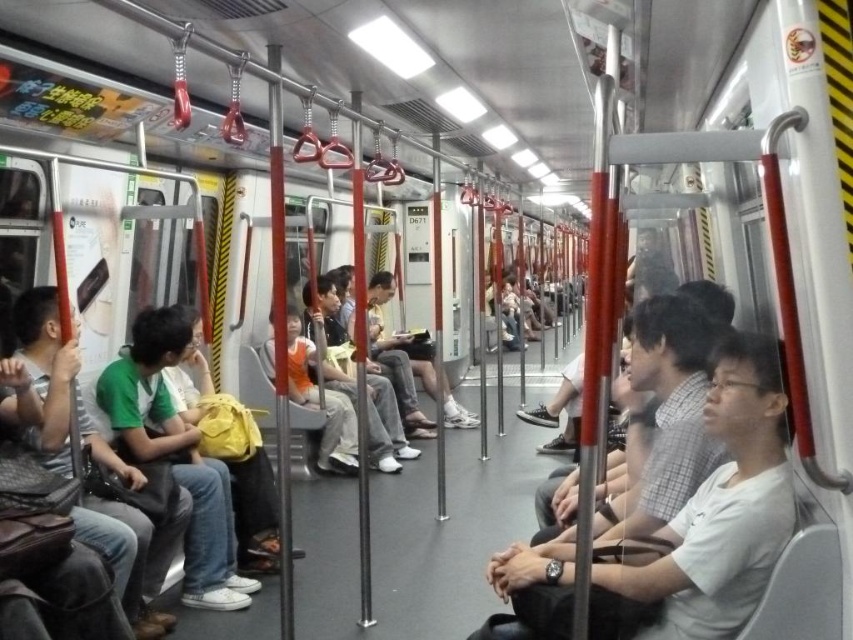
Is white matte shirt at right below yellow fabric backpack at center?

Yes.

Is point (738, 625) farther from viewer compared to point (184, 408)?

No, (738, 625) is closer to viewer.

Between point (773, 483) and point (264, 506), which one is positioned behind?

Point (264, 506)

This screenshot has height=640, width=853. Identify the location of white matte shirt at right. (709, 516).

Can you confirm if green fabric backpack at left is positioned to the right of yellow fabric backpack at center?

Yes, green fabric backpack at left is to the right of yellow fabric backpack at center.

This screenshot has width=853, height=640. I want to click on green fabric backpack at left, so coord(177,454).

Where is `green fabric backpack at left`? The height and width of the screenshot is (640, 853). green fabric backpack at left is located at coordinates (177, 454).

Which is above, white matte shirt at right or green fabric backpack at left?

white matte shirt at right is above.

Is white matte shirt at right bigger than green fabric backpack at left?

Actually, white matte shirt at right might be smaller than green fabric backpack at left.

Between point (712, 420) and point (198, 561), which one is positioned in front?

Point (712, 420)

You are a GUI agent. You are given a task and a screenshot of the screen. Output one action in this format:
    pyautogui.click(x=<x>, y=<y>)
    Task: Click on the white matte shirt at right
    The height and width of the screenshot is (640, 853).
    Given the screenshot: What is the action you would take?
    pyautogui.click(x=709, y=516)